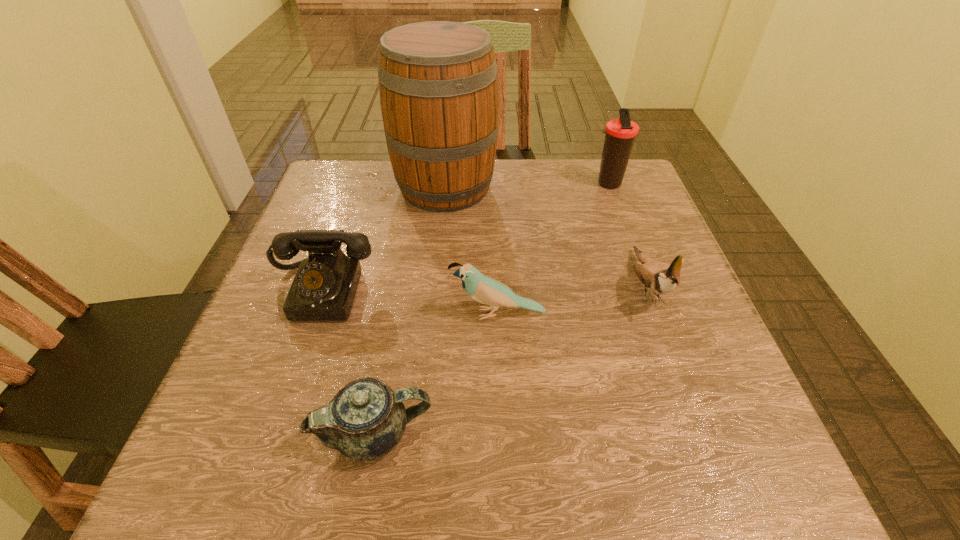
Identify the location of free location located at the face of the left bird. (371, 314).

This screenshot has width=960, height=540. What are the coordinates of `vacant space located at the face of the left bird` in the screenshot? It's located at (317, 314).

Identify the location of free region located at the face of the left bird. Image resolution: width=960 pixels, height=540 pixels. (424, 314).

This screenshot has width=960, height=540. Find the location of `vacant space located 0.110m on the dial of the telephone`. vacant space located 0.110m on the dial of the telephone is located at coordinates (294, 375).

At what (x,y) coordinates should I click in order to perform the action: click on free location located from the spout of the chinaware. Please return your answer as a coordinate pair (x, y). Looking at the image, I should click on (518, 433).

Find the location of `cider that is at the far edge`. cider that is at the far edge is located at coordinates (438, 84).

This screenshot has height=540, width=960. I want to click on thermos bottle that is at the far edge, so pos(620,133).

Where is `object located in the near edge section of the desktop`? The width and height of the screenshot is (960, 540). object located in the near edge section of the desktop is located at coordinates (366, 419).

This screenshot has height=540, width=960. In order to click on object situated at the left edge in this screenshot , I will do `click(324, 288)`.

I want to click on thermos bottle that is at the right edge, so click(620, 133).